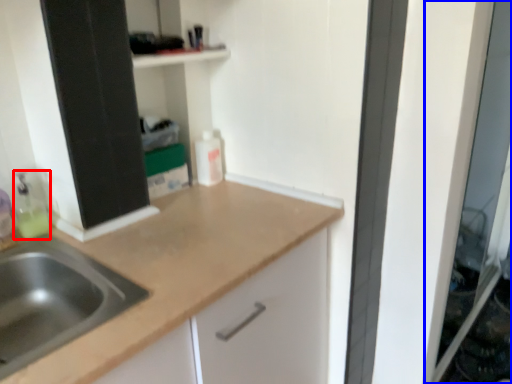
Question: Which point is closer to the camera, cleaning product (highlighted by a red box) or screen door (highlighted by a blue box)?

Choices:
 (A) cleaning product
 (B) screen door

Answer: (A)